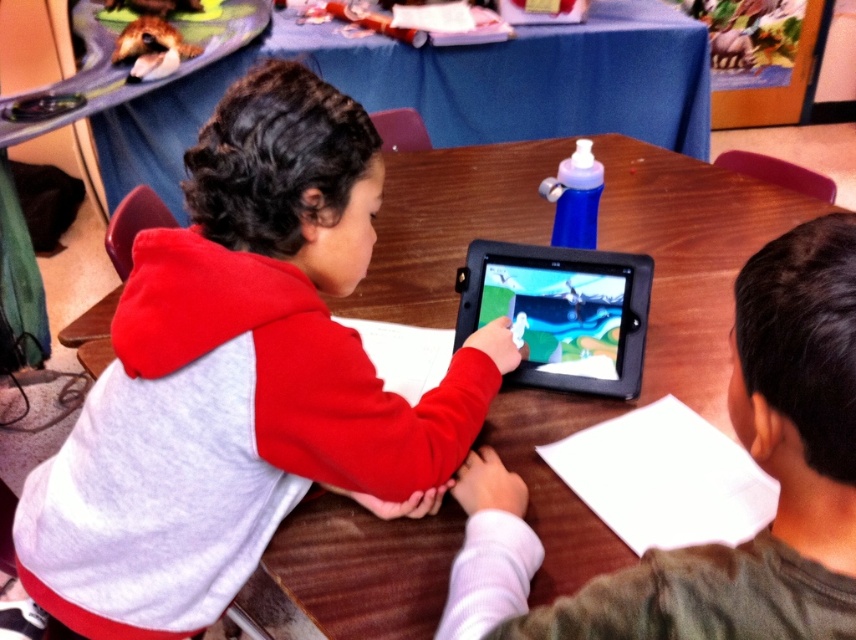
Is smooth black tablet at center thinner than black plastic tablet at center?

In fact, smooth black tablet at center might be wider than black plastic tablet at center.

Who is shorter, smooth black tablet at center or black plastic tablet at center?

Standing shorter between the two is black plastic tablet at center.

You are a GUI agent. You are given a task and a screenshot of the screen. Output one action in this format:
    pyautogui.click(x=<x>, y=<y>)
    Task: Click on the smooth black tablet at center
    The image size is (856, 640).
    Given the screenshot: What is the action you would take?
    pyautogui.click(x=753, y=460)

Identify the location of smooth black tablet at center. (753, 460).

Is matte red hoodie at center above smooth black tablet at center?

Incorrect, matte red hoodie at center is not positioned above smooth black tablet at center.

Does point (302, 296) lie behind point (783, 458)?

Yes, point (302, 296) is behind point (783, 458).

Where is `matte red hoodie at center`? Image resolution: width=856 pixels, height=640 pixels. matte red hoodie at center is located at coordinates (241, 378).

Is point (390, 438) closer to camera compared to point (542, 372)?

Yes.

Who is more forward, (189,608) or (569,259)?

Positioned in front is point (189,608).

Where is `matte red hoodie at center`? Image resolution: width=856 pixels, height=640 pixels. matte red hoodie at center is located at coordinates (241, 378).